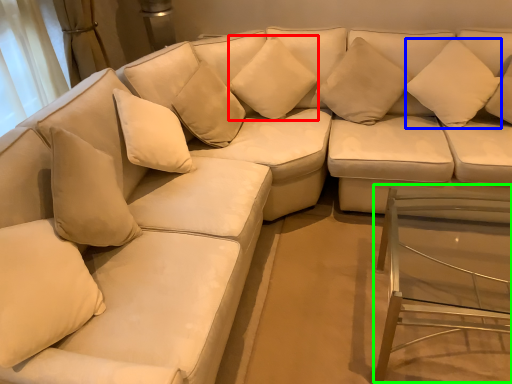
Question: Which object is positioned closest to pillow (highlighted by a red box)? Select from pillow (highlighted by a blue box) and glass table (highlighted by a green box).

Choices:
 (A) pillow
 (B) glass table

Answer: (A)